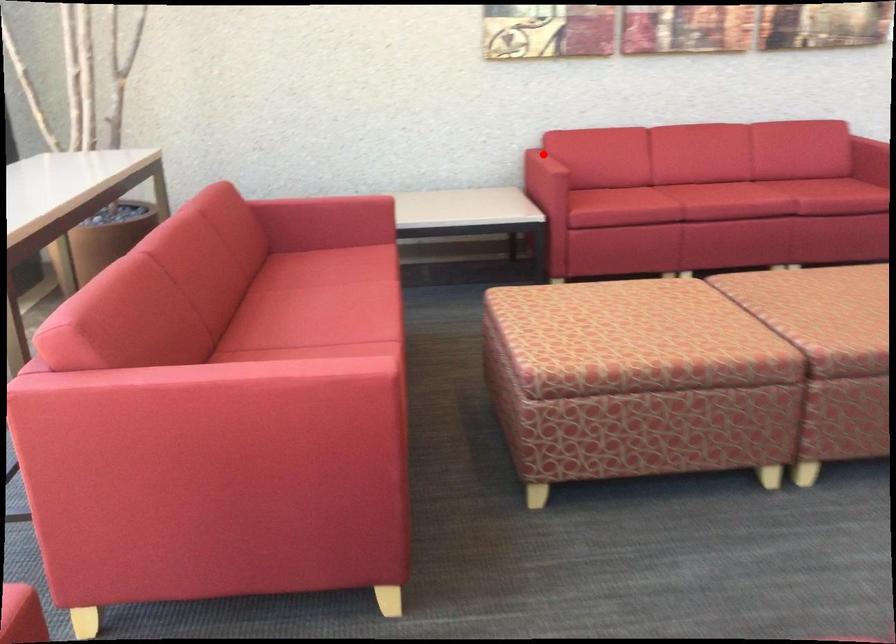
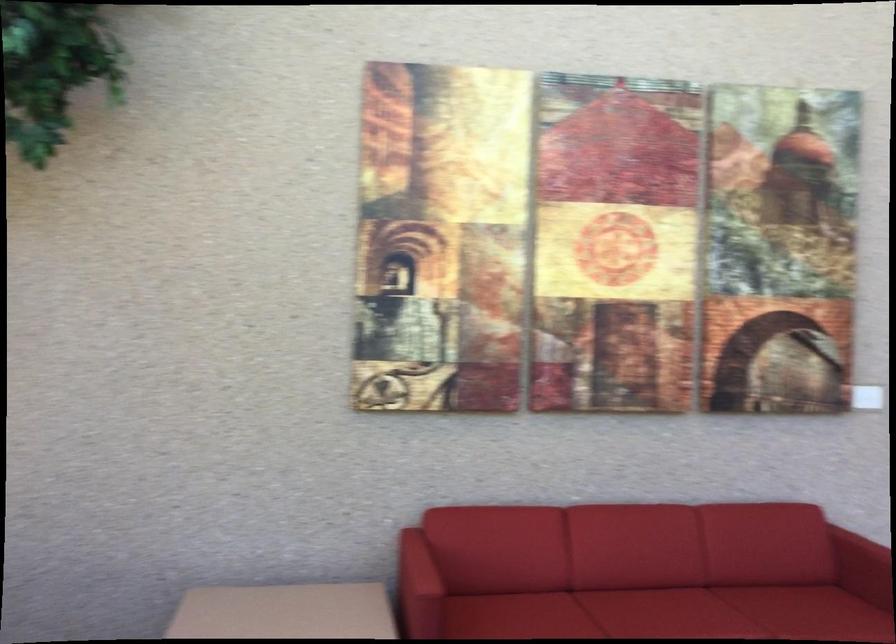
Question: I am providing you with two images of the same scene from different viewpoints. A red point is shown in image1. For the corresponding object point in image2, is it positioned nearer or farther from the camera?

Choices:
 (A) Nearer
 (B) Farther

Answer: (A)